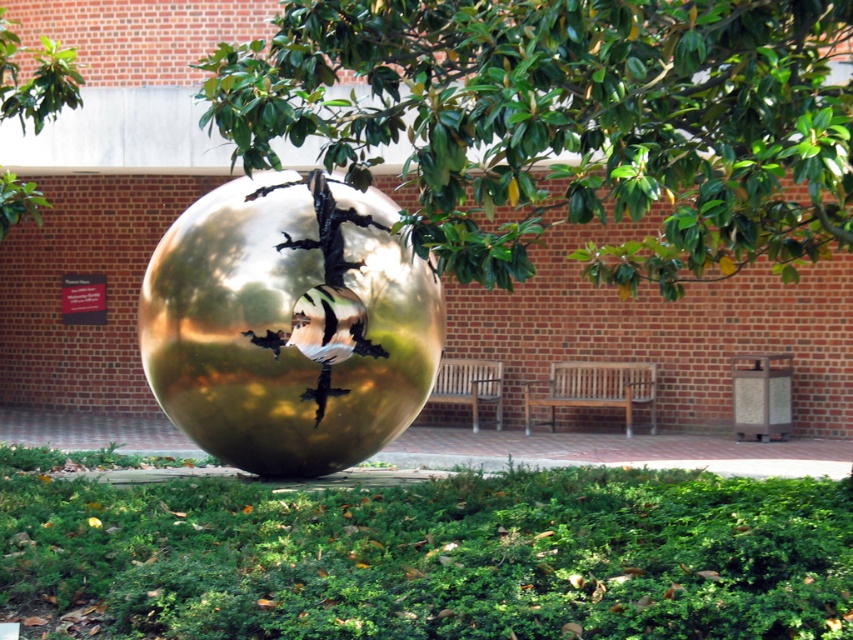
You are standing in front of the sculpture and want to sit down on the wooden bench at center. Is the bench closer to you or farther away than the gold reflective sphere at center?

The gold reflective sphere at center is closer to the viewer than the wooden bench at center, so the bench is farther away.

You are a painter who wants to set up your easel between the wooden bench at center and the wooden park bench at center to paint the metallic sphere sculpture. Is there enough space to place your easel between them?

The wooden bench at center and the wooden park bench at center are 3.80 feet apart from each other. Since the average easel requires about 3 feet of space, there is enough room to place the easel between them.